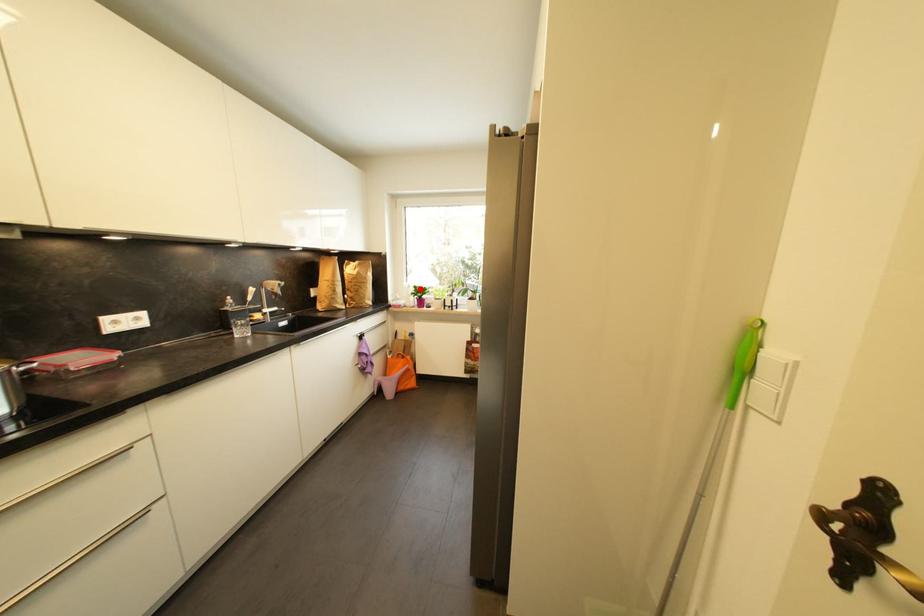
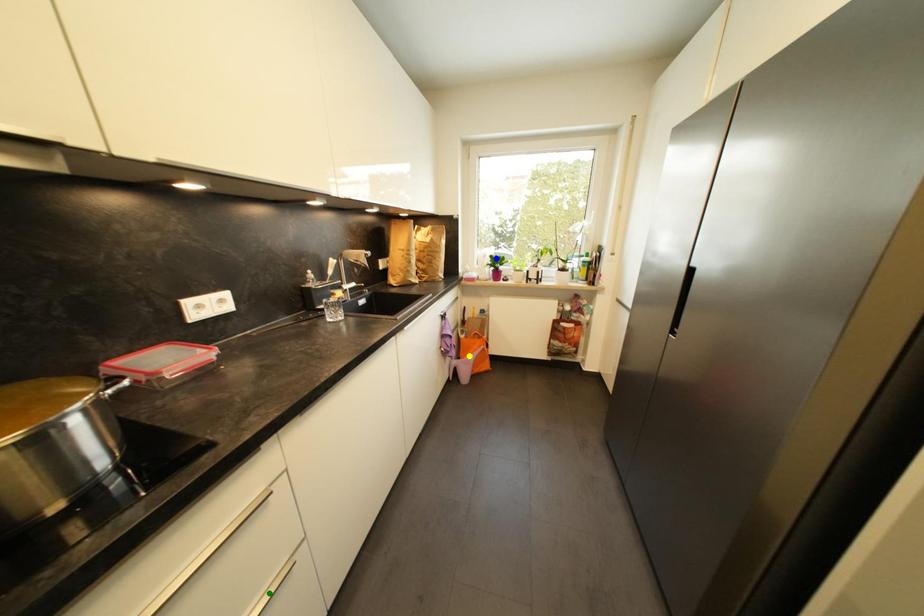
Question: I am providing you with two images of the same scene from different viewpoints. A red point is marked on the first image. You are given multiple points on the second image. Which mark in image 2 goes with the point in image 1?

Choices:
 (A) green point
 (B) blue point
 (C) yellow point

Answer: (B)